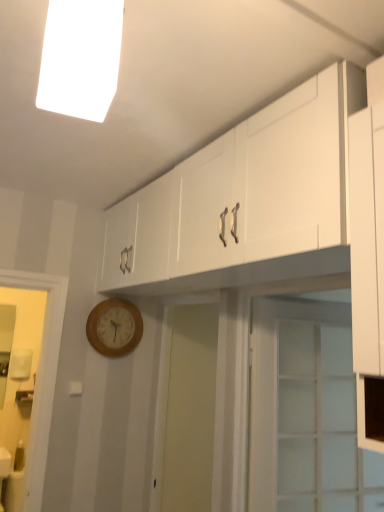
Question: Based on their sizes in the image, would you say wooden wall clock at lower left is bigger or smaller than white glossy cabinet at upper center?

Choices:
 (A) big
 (B) small

Answer: (B)

Question: From a real-world perspective, is wooden wall clock at lower left physically located above or below white glossy cabinet at upper center?

Choices:
 (A) above
 (B) below

Answer: (B)

Question: Estimate the real-world distances between objects in this image. Which object is closer to the wooden wall clock at lower left?

Choices:
 (A) white glossy cabinet at upper center
 (B) clear glass door at center
 (C) white fluorescent light at upper center

Answer: (A)

Question: Estimate the real-world distances between objects in this image. Which object is farther from the wooden wall clock at lower left?

Choices:
 (A) clear glass door at center
 (B) white glossy cabinet at upper center
 (C) white fluorescent light at upper center

Answer: (C)